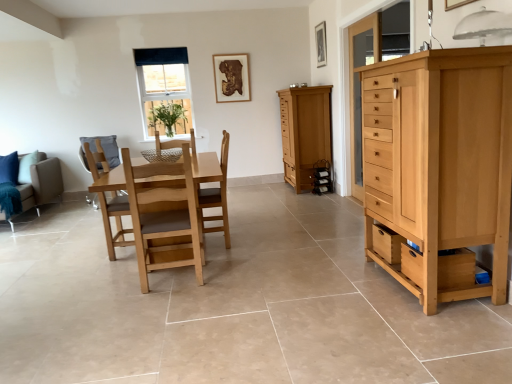
You are a GUI agent. You are given a task and a screenshot of the screen. Output one action in this format:
    pyautogui.click(x=<x>, y=<y>)
    Task: Click on the clear glass window at upper center
    
    Given the screenshot: What is the action you would take?
    pyautogui.click(x=164, y=90)

This screenshot has height=384, width=512. Describe the element at coordinates (387, 243) in the screenshot. I see `wooden drawer at lower right` at that location.

I want to click on wooden picture frame at upper center, the second picture frame from the front, so click(231, 78).

This screenshot has height=384, width=512. I want to click on brown fabric couch at left, so click(x=41, y=183).

Describe the element at coordinates (111, 199) in the screenshot. I see `light brown wooden chair at center, which appears as the 2th chair when viewed from the right` at that location.

The width and height of the screenshot is (512, 384). What are the coordinates of `clear glass window at upper center` in the screenshot? It's located at (164, 90).

Is the position of wooden picture frame at upper center, the first picture frame from the right, less distant than that of light brown wood chair at center, which ranks as the second chair in left-to-right order?

No, it is not.

From the image's perspective, relative to light brown wood chair at center, the 1th chair positioned from the right, is wooden picture frame at upper center, arranged as the second picture frame when viewed from the back, above or below?

Based on their image positions, wooden picture frame at upper center, arranged as the second picture frame when viewed from the back, is located above light brown wood chair at center, the 1th chair positioned from the right.

Looking at this image, is wooden picture frame at upper center, the first picture frame from the right, taller or shorter than light brown wood chair at center, which ranks as the second chair in left-to-right order?

Considering their sizes, wooden picture frame at upper center, the first picture frame from the right, has less height than light brown wood chair at center, which ranks as the second chair in left-to-right order.

Which chair is the 1st one when counting from the front of the wooden picture frame at upper center, placed as the second picture frame when sorted from left to right? Please provide its 2D coordinates.

[(218, 196)]

In the scene shown: How different are the orientations of natural wood chest of drawers at right and light brown wooden swivel chair at center-left in degrees?

They differ by 105 degrees in their facing directions.

Is light brown wooden swivel chair at center-left at the back of natural wood chest of drawers at right?

That's not correct — natural wood chest of drawers at right is not looking away from light brown wooden swivel chair at center-left.

Is natural wood chest of drawers at right not close to light brown wooden swivel chair at center-left?

Yes.

From a real-world perspective, relative to light brown wooden swivel chair at center-left, is natural wood chest of drawers at right vertically above or below?

From a real-world perspective, natural wood chest of drawers at right is physically above light brown wooden swivel chair at center-left.

In the scene shown: Does wooden picture frame at upper center, arranged as the second picture frame when viewed from the back, have a larger size compared to light brown wooden chair at center, which appears as the 2th chair when viewed from the right?

No, wooden picture frame at upper center, arranged as the second picture frame when viewed from the back, is not bigger than light brown wooden chair at center, which appears as the 2th chair when viewed from the right.

Considering the points (325, 47) and (109, 180), which point is in front, point (325, 47) or point (109, 180)?

Point (109, 180)

Is wooden picture frame at upper center, placed as the 1th picture frame when sorted from front to back, located outside light brown wooden chair at center, which appears as the 2th chair when viewed from the right?

Yes.

Considering the relative sizes of matte wood cabinet at center and light brown wooden swivel chair at center-left in the image provided, is matte wood cabinet at center bigger than light brown wooden swivel chair at center-left?

Yes.

Measure the distance from matte wood cabinet at center to light brown wooden swivel chair at center-left.

A distance of 8.84 feet exists between matte wood cabinet at center and light brown wooden swivel chair at center-left.

From the image's perspective, is matte wood cabinet at center located beneath light brown wooden swivel chair at center-left?

Incorrect, from the image's perspective, matte wood cabinet at center is higher than light brown wooden swivel chair at center-left.

From a real-world perspective, which object stands above the other?

matte wood cabinet at center, from a real-world perspective.

Which is in front, matte wood cabinet at center or wooden picture frame at upper center, placed as the second picture frame when sorted from left to right?

matte wood cabinet at center is in front.

In the scene shown: Can you confirm if matte wood cabinet at center is thinner than wooden picture frame at upper center, placed as the second picture frame when sorted from left to right?

Incorrect, the width of matte wood cabinet at center is not less than that of wooden picture frame at upper center, placed as the second picture frame when sorted from left to right.

Image resolution: width=512 pixels, height=384 pixels. Identify the location of picture frame on the right of the matte wood cabinet at center. (321, 44).

Considering the positions of point (92, 203) and point (28, 189), is point (92, 203) closer or farther from the camera than point (28, 189)?

Point (92, 203) is positioned farther from the camera compared to point (28, 189).

Looking at this image, between light brown wooden swivel chair at center-left and brown fabric couch at left, which one has larger width?

brown fabric couch at left is wider.

From the image's perspective, which is below, light brown wooden swivel chair at center-left or brown fabric couch at left?

brown fabric couch at left appears lower in the image.

Considering the sizes of objects light brown wooden swivel chair at center-left and brown fabric couch at left in the image provided, who is shorter, light brown wooden swivel chair at center-left or brown fabric couch at left?

brown fabric couch at left.

Is wooden picture frame at upper center, arranged as the second picture frame when viewed from the back, not within clear glass window at upper center?

wooden picture frame at upper center, arranged as the second picture frame when viewed from the back, lies outside clear glass window at upper center's area.

Does wooden picture frame at upper center, placed as the second picture frame when sorted from left to right, lie in front of clear glass window at upper center?

Yes, wooden picture frame at upper center, placed as the second picture frame when sorted from left to right, is closer to the camera.

This screenshot has width=512, height=384. I want to click on the 2nd picture frame to the right of the clear glass window at upper center, starting your count from the anchor, so click(321, 44).

Is wooden picture frame at upper center, placed as the 1th picture frame when sorted from front to back, in contact with clear glass window at upper center?

No, wooden picture frame at upper center, placed as the 1th picture frame when sorted from front to back, is not making contact with clear glass window at upper center.

From the image's perspective, count 1st chairs downward from the wooden picture frame at upper center, placed as the 1th picture frame when sorted from front to back, and point to it. Please provide its 2D coordinates.

[(218, 196)]

Identify the location of swivel chair located above the natural wood chest of drawers at right (from the image's perspective). The image size is (512, 384). (101, 149).

Which object lies further to the anchor point brown fabric couch at left, light brown wooden swivel chair at center-left or wooden picture frame at upper center, the second picture frame from the front?

The object further to brown fabric couch at left is wooden picture frame at upper center, the second picture frame from the front.

Considering their positions, is brown fabric couch at left positioned closer to wooden picture frame at upper center, the first picture frame from the right, than natural wood chest of drawers at right?

natural wood chest of drawers at right is positioned closer to the anchor wooden picture frame at upper center, the first picture frame from the right.

Based on their spatial positions, is transparent glass cabinet at right or light brown wood chair at center, which ranks as the second chair in left-to-right order, further from wooden picture frame at upper center, placed as the second picture frame when sorted from left to right?

The object further to wooden picture frame at upper center, placed as the second picture frame when sorted from left to right, is light brown wood chair at center, which ranks as the second chair in left-to-right order.

Based on their spatial positions, is light brown wood chair at center, which ranks as the second chair in left-to-right order, or matte wood cabinet at center closer to brown fabric couch at left?

light brown wood chair at center, which ranks as the second chair in left-to-right order.

Looking at the image, which one is located closer to matte wood cabinet at center, clear glass window at upper center or light brown wooden swivel chair at center-left?

clear glass window at upper center lies closer to matte wood cabinet at center than the other object.

Which object lies further to the anchor point wooden drawer at lower right, wooden picture frame at upper center, placed as the 2th picture frame when sorted from right to left, or clear glass window at upper center?

wooden picture frame at upper center, placed as the 2th picture frame when sorted from right to left, is further to wooden drawer at lower right.

Based on their spatial positions, is natural wood chest of drawers at right or brown fabric couch at left further from wooden drawer at lower right?

brown fabric couch at left lies further to wooden drawer at lower right than the other object.

Considering their positions, is matte wood cabinet at center positioned closer to brown fabric couch at left than clear glass window at upper center?

Among the two, clear glass window at upper center is located nearer to brown fabric couch at left.

This screenshot has height=384, width=512. I want to click on swivel chair between light brown wood chair at center, which ranks as the second chair in left-to-right order, and clear glass window at upper center from front to back, so click(101, 149).

Identify the location of chest of drawers between light brown wooden swivel chair at center-left and transparent glass cabinet at right. coord(440,162).

Image resolution: width=512 pixels, height=384 pixels. Identify the location of cabinetry between brown fabric couch at left and wooden drawer at lower right. (304, 132).

Locate an element on the screen. Image resolution: width=512 pixels, height=384 pixels. cabinetry located between light brown wood chair at center, the 1th chair positioned from the right, and wooden picture frame at upper center, marked as the 1th picture frame in a back-to-front arrangement, in the depth direction is located at coordinates (304, 132).